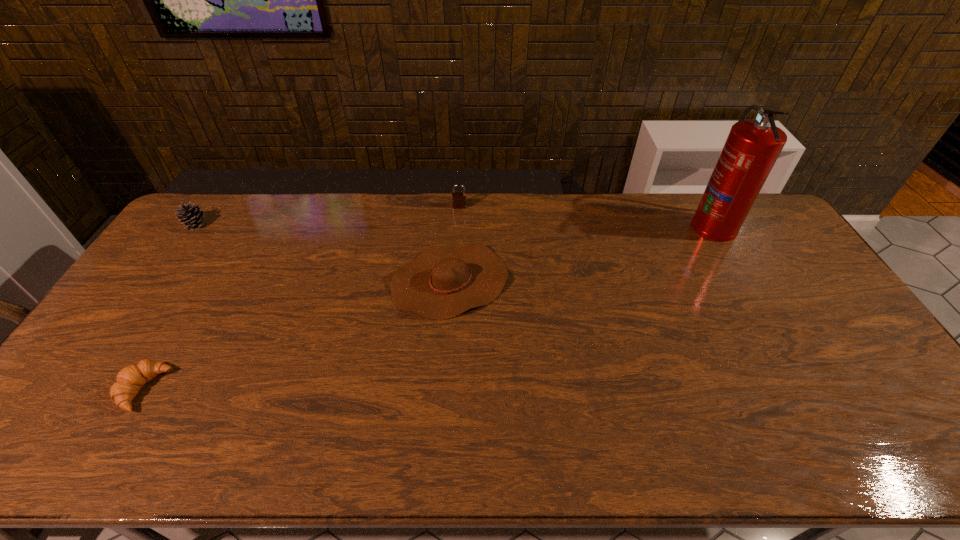
Identify the location of object located in the right edge section of the desktop. (752, 147).

I want to click on object situated at the far left corner, so click(x=193, y=217).

At what (x,y) coordinates should I click in order to perform the action: click on object that is at the far right corner. Please return your answer as a coordinate pair (x, y). Looking at the image, I should click on coord(752,147).

Where is `vacant space at the far edge of the desktop`? The height and width of the screenshot is (540, 960). vacant space at the far edge of the desktop is located at coordinates (588, 218).

At what (x,y) coordinates should I click in order to perform the action: click on free region at the near edge of the desktop. Please return your answer as a coordinate pair (x, y). The width and height of the screenshot is (960, 540). Looking at the image, I should click on (645, 429).

In the image, there is a desktop. Identify the location of vacant region at the right edge. The height and width of the screenshot is (540, 960). (778, 256).

You are a GUI agent. You are given a task and a screenshot of the screen. Output one action in this format:
    pyautogui.click(x=<x>, y=<y>)
    Task: Click on the vacant space at the near left corner
    This screenshot has height=540, width=960.
    Given the screenshot: What is the action you would take?
    pyautogui.click(x=26, y=456)

This screenshot has height=540, width=960. What are the coordinates of `free space between the padlock and the shortest object` in the screenshot? It's located at (301, 298).

The width and height of the screenshot is (960, 540). I want to click on free space between the leftmost object and the crescent roll, so click(170, 307).

This screenshot has height=540, width=960. I want to click on empty space between the padlock and the crescent roll, so click(x=301, y=298).